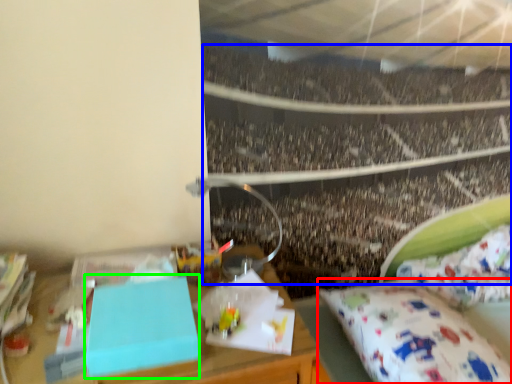
Question: Based on their relative distances, which object is nearer to mattress (highlighted by a red box)? Choose from crowd (highlighted by a blue box) and box (highlighted by a green box).

Choices:
 (A) crowd
 (B) box

Answer: (B)